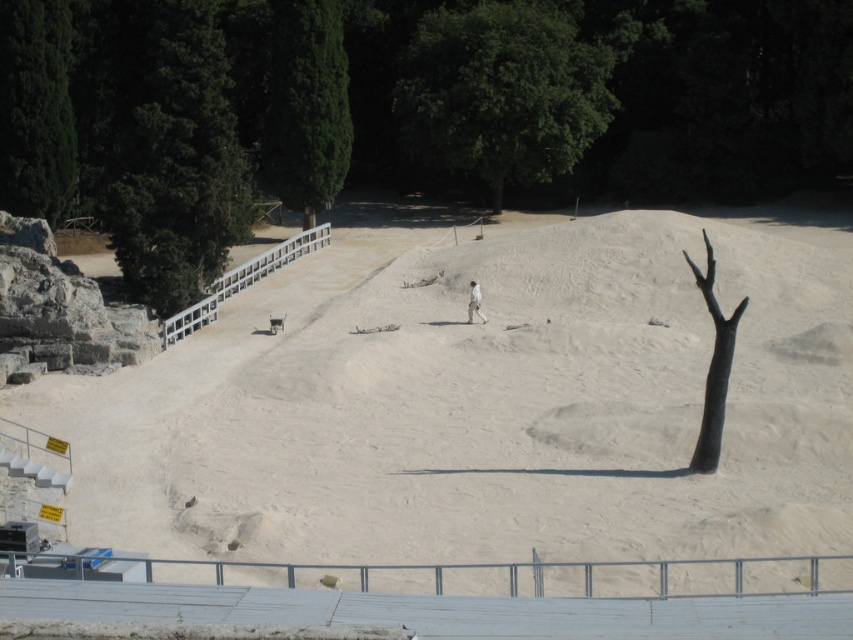
You are planning to take a photo of the white matte skier at center and the green leafy tree at upper center from the lower part of the image. Which object will appear larger in the photo?

The green leafy tree at upper center will appear larger in the photo because it is taller than the white matte skier at center.

From the picture: Based on the coordinates provided, which object corresponds to the point located at (x=305, y=106) in the image?

The green textured tree at upper center corresponds to the point located at (x=305, y=106) in the image.

You are standing at the base of the steps leading up to the sandy area and want to reach the person walking there. You notice two points marked in the image. Which point is closer to you, point (293, 132) or point (721, 342)?

Point (293, 132) is closer to you because it is further to the viewer than point (721, 342).